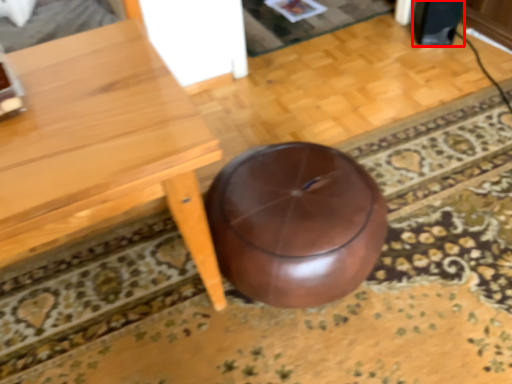
Question: From the image's perspective, what is the correct spatial positioning of speaker (annotated by the red box) in reference to table?

Choices:
 (A) below
 (B) above

Answer: (B)